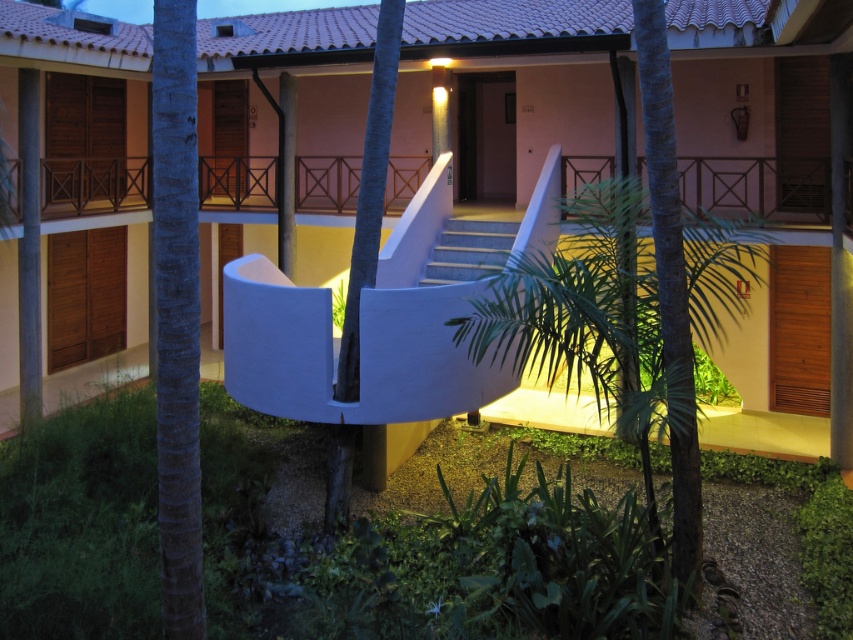
From the picture: Is green leafy palm tree at center thinner than dark blue bark at left?

No.

Does point (733, 269) come farther from viewer compared to point (163, 577)?

That is True.

Does point (584, 300) come closer to viewer compared to point (175, 68)?

No, (584, 300) is behind (175, 68).

At what (x,y) coordinates should I click in order to perform the action: click on green leafy palm tree at center. Please return your answer as a coordinate pair (x, y). Looking at the image, I should click on (621, 326).

Between green leafy palm tree at center and green leafy tree at center, which one is positioned lower?

Positioned lower is green leafy palm tree at center.

Between point (514, 332) and point (329, 493), which one is positioned behind?

The point (329, 493) is behind.

Locate an element on the screen. This screenshot has height=640, width=853. green leafy palm tree at center is located at coordinates (621, 326).

Who is higher up, white concrete staircase at center or green leafy palm tree at center?

white concrete staircase at center is above.

Is white concrete staircase at center closer to camera compared to green leafy palm tree at center?

No, it is behind green leafy palm tree at center.

Where is `white concrete staircase at center`? This screenshot has height=640, width=853. white concrete staircase at center is located at coordinates (508, 90).